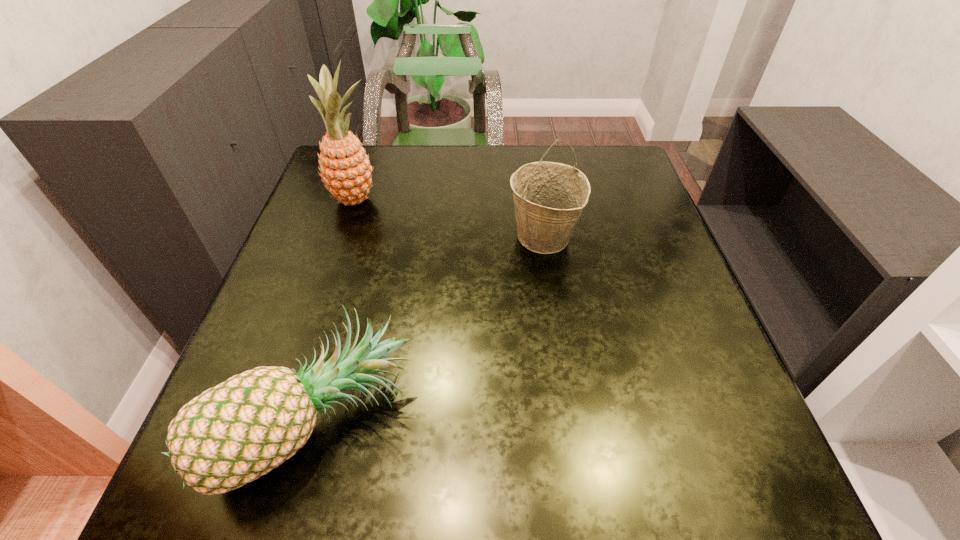
Image resolution: width=960 pixels, height=540 pixels. In order to click on object positioned at the near edge in this screenshot , I will do `click(231, 434)`.

The image size is (960, 540). I want to click on object present at the far left corner, so click(345, 168).

Identify the location of object that is at the near left corner. This screenshot has height=540, width=960. (231, 434).

This screenshot has height=540, width=960. What are the coordinates of `free space at the far edge of the desktop` in the screenshot? It's located at (413, 151).

At what (x,y) coordinates should I click in order to perform the action: click on free space at the near edge of the desktop. Please return your answer as a coordinate pair (x, y). Looking at the image, I should click on (625, 474).

The width and height of the screenshot is (960, 540). Find the location of `vacant space at the left edge of the desktop`. vacant space at the left edge of the desktop is located at coordinates (300, 247).

In the image, there is a desktop. Identify the location of vacant space at the right edge. (603, 238).

The width and height of the screenshot is (960, 540). Find the location of `vacant space at the far left corner of the desktop`. vacant space at the far left corner of the desktop is located at coordinates (372, 177).

Image resolution: width=960 pixels, height=540 pixels. I want to click on free space at the far right corner of the desktop, so click(x=600, y=159).

The width and height of the screenshot is (960, 540). I want to click on unoccupied position between the taller pineapple and the nearest object, so click(x=335, y=310).